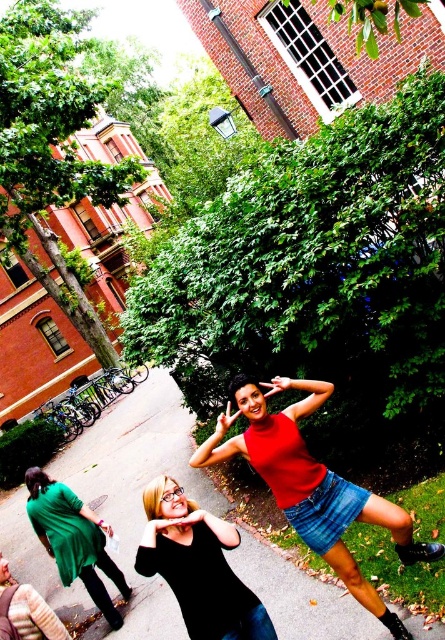
Question: Does matte red tank top at center come behind green matte dress at lower left?

Choices:
 (A) yes
 (B) no

Answer: (B)

Question: Among these points, which one is nearest to the camera?

Choices:
 (A) (407, 524)
 (B) (81, 506)
 (C) (166, 508)

Answer: (C)

Question: Is matte red tank top at center wider than green matte dress at lower left?

Choices:
 (A) yes
 (B) no

Answer: (A)

Question: Which point appears farthest from the camera in this image?

Choices:
 (A) (152, 548)
 (B) (68, 525)

Answer: (B)

Question: Which point is closer to the camera taking this photo?

Choices:
 (A) (109, 596)
 (B) (335, 480)
 (C) (210, 637)

Answer: (C)

Question: Is matte red tank top at center bigger than green matte dress at lower left?

Choices:
 (A) yes
 (B) no

Answer: (A)